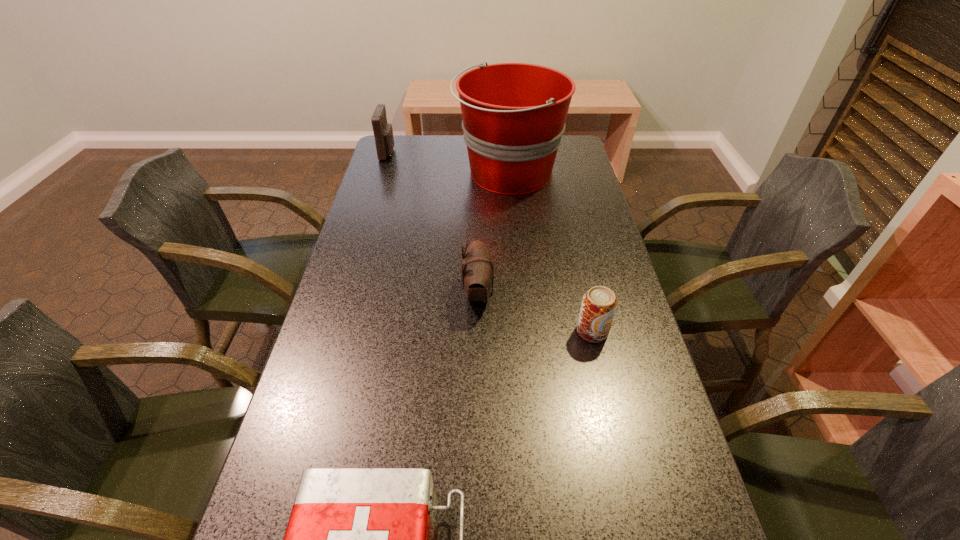
At what (x,y) coordinates should I click in order to perform the action: click on bucket that is at the far edge. Please return your answer as a coordinate pair (x, y). Image resolution: width=960 pixels, height=540 pixels. Looking at the image, I should click on (514, 114).

The image size is (960, 540). In order to click on pouch located in the far edge section of the desktop in this screenshot , I will do `click(383, 132)`.

What are the coordinates of `object that is at the left edge` in the screenshot? It's located at (383, 132).

I want to click on bucket located in the right edge section of the desktop, so click(x=514, y=114).

Find the location of a particular element. Image resolution: width=960 pixels, height=540 pixels. beer can that is positioned at the right edge is located at coordinates (599, 304).

In order to click on object located in the far left corner section of the desktop in this screenshot , I will do `click(383, 132)`.

The width and height of the screenshot is (960, 540). In order to click on object present at the far right corner in this screenshot , I will do [514, 114].

Find the location of a particular element. The image size is (960, 540). vacant area at the left edge of the desktop is located at coordinates (369, 240).

Locate an element on the screen. The image size is (960, 540). free spot at the right edge of the desktop is located at coordinates click(626, 320).

Locate an element on the screen. vacant area that lies between the fourth farthest object and the tallest object is located at coordinates (550, 253).